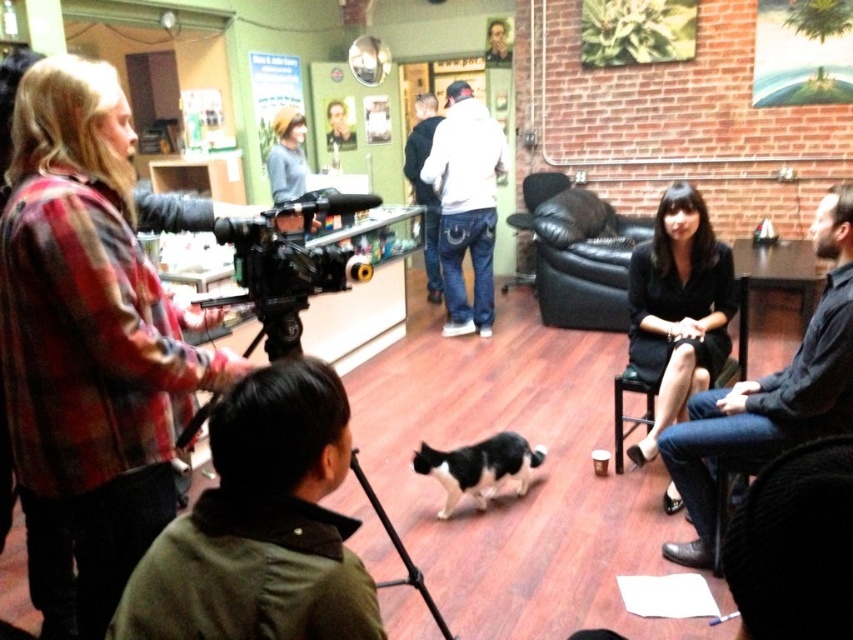
Can you confirm if black leather chair at lower right is taller than black satin dress at center?

No.

Which is behind, point (761, 452) or point (651, 426)?

Positioned behind is point (651, 426).

In order to click on black leather chair at lower right in this screenshot , I will do `click(770, 394)`.

At what (x,y) coordinates should I click in order to perform the action: click on black leather chair at lower right. Please return your answer as a coordinate pair (x, y). The image size is (853, 640). Looking at the image, I should click on (770, 394).

In the scene shown: Who is more distant from viewer, (636, 344) or (242, 269)?

The point (636, 344) is more distant.

Is black satin dress at center thinner than black plastic video camera at left?

No.

Identify the location of black satin dress at center. (677, 308).

Does flannel shirt at left lie behind black satin dress at center?

No.

Can you confirm if flannel shirt at left is thinner than black satin dress at center?

No, flannel shirt at left is not thinner than black satin dress at center.

What do you see at coordinates (86, 339) in the screenshot?
I see `flannel shirt at left` at bounding box center [86, 339].

I want to click on flannel shirt at left, so click(x=86, y=339).